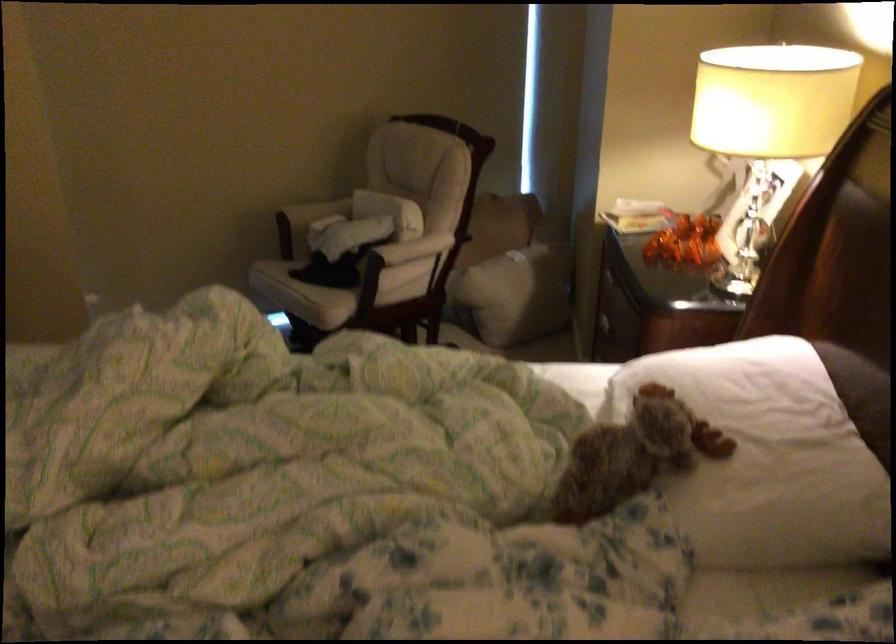
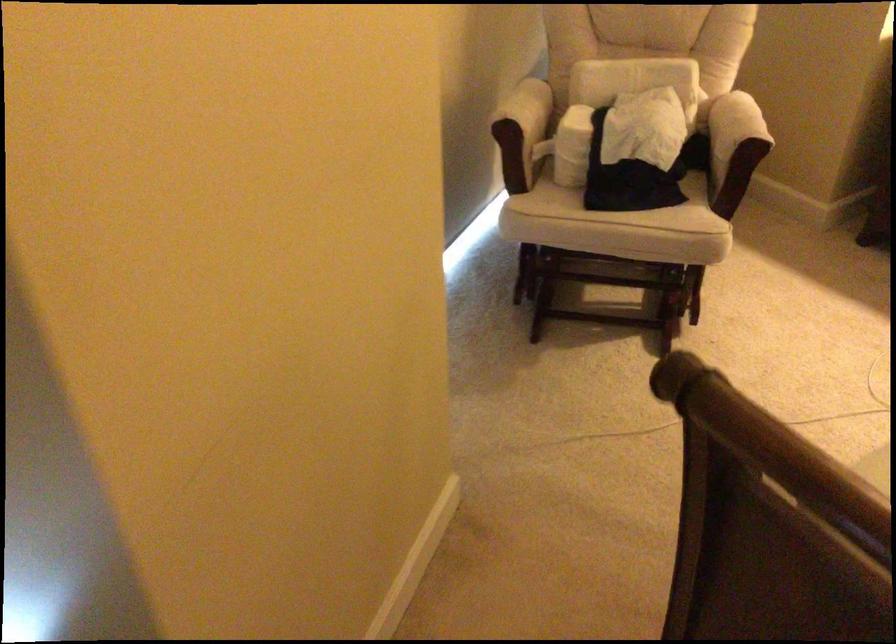
Locate, in the second image, the point that corresponds to pixel 415 250 in the first image.

(778, 128)